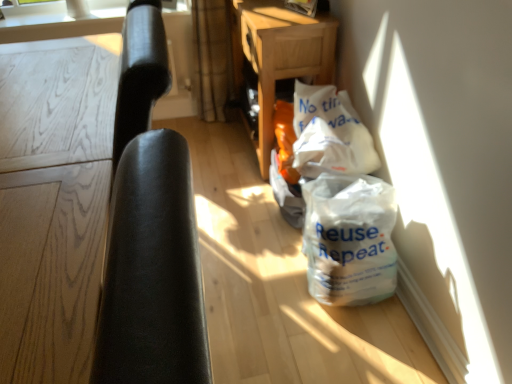
Question: Would you say white paper bag at center is part of black leather chair at left's contents?

Choices:
 (A) yes
 (B) no

Answer: (B)

Question: Could you tell me if black leather chair at left is turned towards white paper bag at center?

Choices:
 (A) no
 (B) yes

Answer: (A)

Question: From the image's perspective, is black leather chair at left under white paper bag at center?

Choices:
 (A) yes
 (B) no

Answer: (A)

Question: Is black leather chair at left smaller than white paper bag at center?

Choices:
 (A) no
 (B) yes

Answer: (A)

Question: Considering the relative sizes of black leather chair at left and white paper bag at center in the image provided, is black leather chair at left wider than white paper bag at center?

Choices:
 (A) yes
 (B) no

Answer: (A)

Question: Considering the positions of white matte plastic bag at lower right and wooden at center in the image, is white matte plastic bag at lower right taller or shorter than wooden at center?

Choices:
 (A) tall
 (B) short

Answer: (B)

Question: Based on their positions, is white matte plastic bag at lower right located to the left or right of wooden at center?

Choices:
 (A) left
 (B) right

Answer: (B)

Question: Is white matte plastic bag at lower right bigger or smaller than wooden at center?

Choices:
 (A) big
 (B) small

Answer: (B)

Question: In the image, is white matte plastic bag at lower right positioned in front of or behind wooden at center?

Choices:
 (A) behind
 (B) front

Answer: (B)

Question: Considering the positions of wooden at center and white paper bag at center in the image, is wooden at center bigger or smaller than white paper bag at center?

Choices:
 (A) small
 (B) big

Answer: (B)

Question: Considering the positions of wooden at center and white paper bag at center in the image, is wooden at center wider or thinner than white paper bag at center?

Choices:
 (A) wide
 (B) thin

Answer: (A)

Question: From a real-world perspective, is wooden at center above or below white paper bag at center?

Choices:
 (A) below
 (B) above

Answer: (A)

Question: From the image's perspective, is wooden at center positioned above or below white paper bag at center?

Choices:
 (A) above
 (B) below

Answer: (A)

Question: From the image's perspective, relative to black leather chair at left, is white matte plastic bag at lower right above or below?

Choices:
 (A) below
 (B) above

Answer: (A)

Question: Choose the correct answer: Is white matte plastic bag at lower right inside black leather chair at left or outside it?

Choices:
 (A) outside
 (B) inside

Answer: (A)